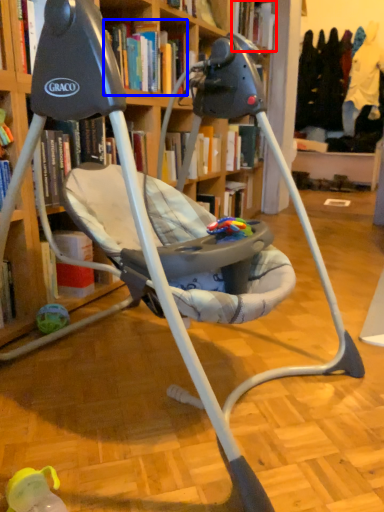
Question: Among these objects, which one is nearest to the camera, book (highlighted by a red box) or book (highlighted by a blue box)?

Choices:
 (A) book
 (B) book

Answer: (B)